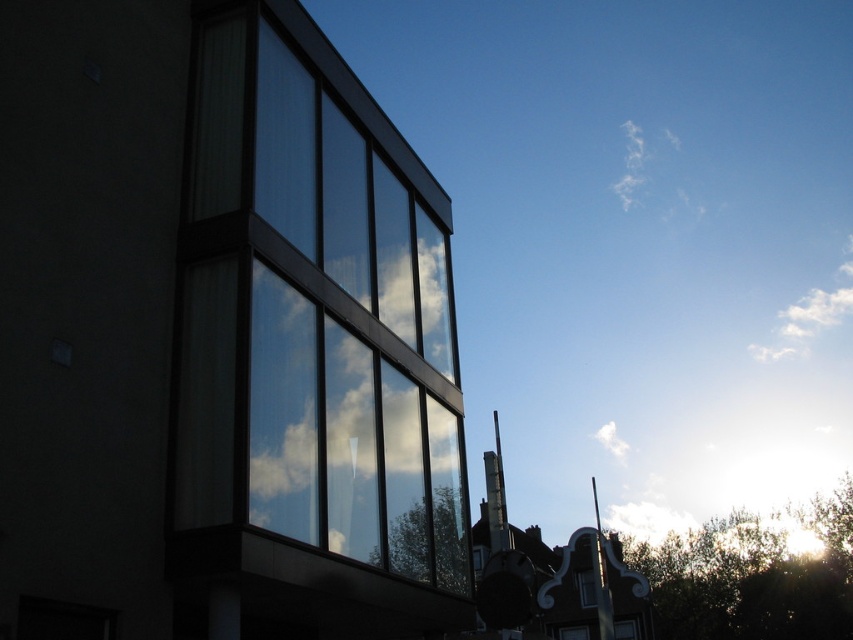
Does transparent glass window at center have a greater width compared to white fluffy cloud at upper right?

Incorrect, transparent glass window at center's width does not surpass white fluffy cloud at upper right's.

Is transparent glass window at center bigger than white fluffy cloud at upper right?

No.

Looking at this image, who is more forward, (242, 68) or (625, 184)?

Positioned in front is point (242, 68).

You are a GUI agent. You are given a task and a screenshot of the screen. Output one action in this format:
    pyautogui.click(x=<x>, y=<y>)
    Task: Click on the transparent glass window at center
    The height and width of the screenshot is (640, 853).
    Given the screenshot: What is the action you would take?
    pyautogui.click(x=314, y=312)